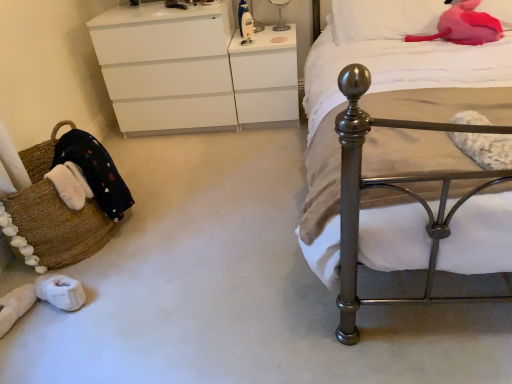
The height and width of the screenshot is (384, 512). In order to click on free space in front of white matte chest of drawers at upper left in this screenshot , I will do `click(204, 165)`.